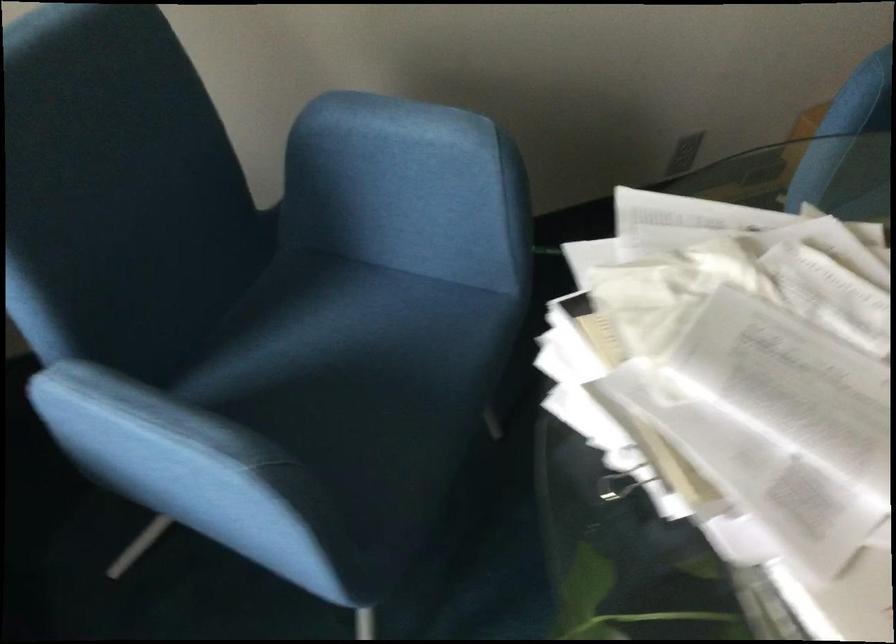
Where would you sit the blue chair sitting surface? Please return your answer as a coordinate pair (x, y).

(328, 342)